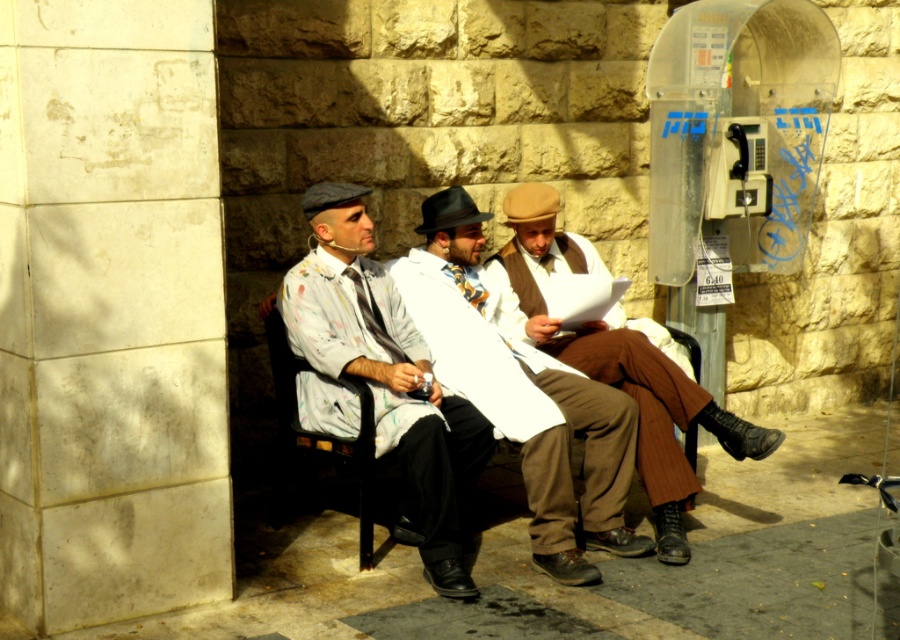
Does white cotton coat at center have a lesser height compared to metallic gray payphone at upper right?

Incorrect, white cotton coat at center's height does not fall short of metallic gray payphone at upper right's.

Is point (441, 353) positioned before point (760, 170)?

That is True.

Identify the location of white cotton coat at center. (522, 394).

Locate an element on the screen. This screenshot has height=640, width=900. white cotton coat at center is located at coordinates (522, 394).

Can you confirm if paint-splattered shirt at center is bigger than brown woolen vest at center?

No.

Between point (299, 410) and point (540, 321), which one is positioned behind?

The point (540, 321) is behind.

Does point (435, 387) lie in front of point (657, 349)?

Yes, it is.

You are a GUI agent. You are given a task and a screenshot of the screen. Output one action in this format:
    pyautogui.click(x=<x>, y=<y>)
    Task: Click on the paint-splattered shirt at center
    This screenshot has width=900, height=640.
    Given the screenshot: What is the action you would take?
    pyautogui.click(x=381, y=376)

Which is behind, point (454, 280) or point (590, 360)?

Positioned behind is point (590, 360).

Can you confirm if white cotton coat at center is positioned to the right of brown woolen vest at center?

No, white cotton coat at center is not to the right of brown woolen vest at center.

Locate an element on the screen. The image size is (900, 640). white cotton coat at center is located at coordinates (522, 394).